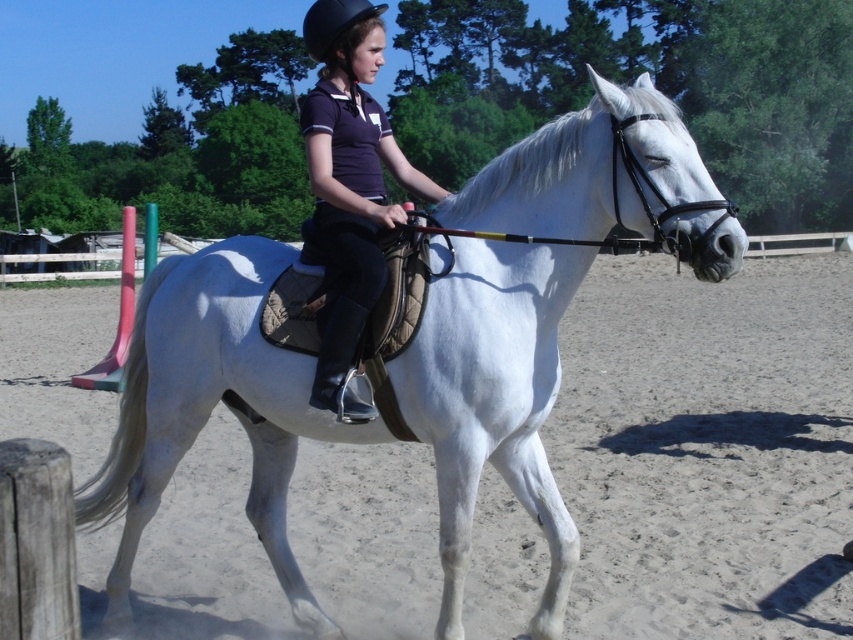
Does white matte/suede saddle at center have a lesser width compared to black matte helmet at upper center?

Yes.

This screenshot has height=640, width=853. What are the coordinates of `white matte/suede saddle at center` in the screenshot? It's located at (212, 406).

Is matte black helmet at upper center wider than black matte helmet at upper center?

No, matte black helmet at upper center is not wider than black matte helmet at upper center.

Describe the element at coordinates (349, 188) in the screenshot. This screenshot has width=853, height=640. I see `matte black helmet at upper center` at that location.

Locate an element on the screen. matte black helmet at upper center is located at coordinates (349, 188).

Is white matte/suede saddle at center smaller than matte black helmet at upper center?

Incorrect, white matte/suede saddle at center is not smaller in size than matte black helmet at upper center.

Who is positioned more to the left, white matte/suede saddle at center or matte black helmet at upper center?

white matte/suede saddle at center

Consider the image. Who is more distant from viewer, (724, 227) or (358, 328)?

The point (358, 328) is more distant.

Identify the location of white matte/suede saddle at center. (212, 406).